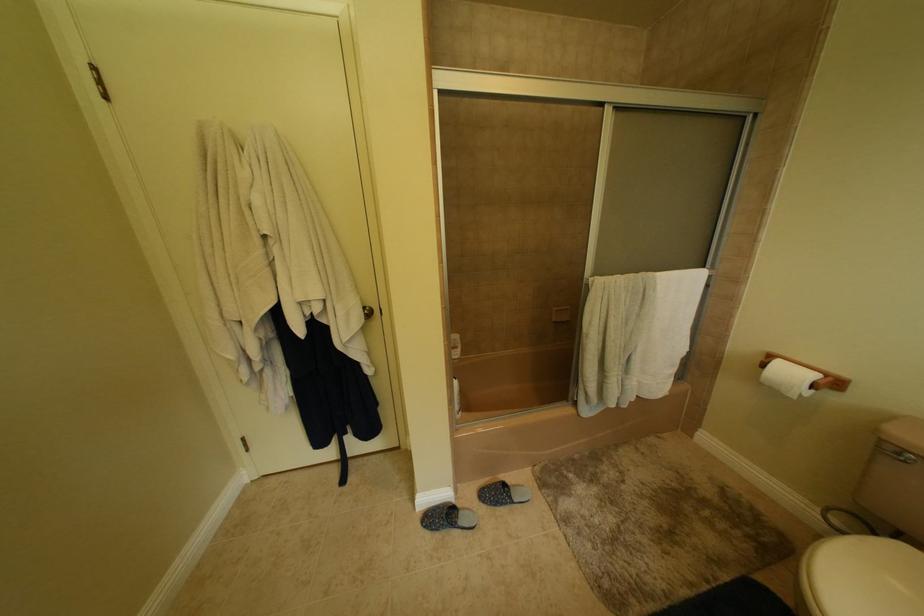
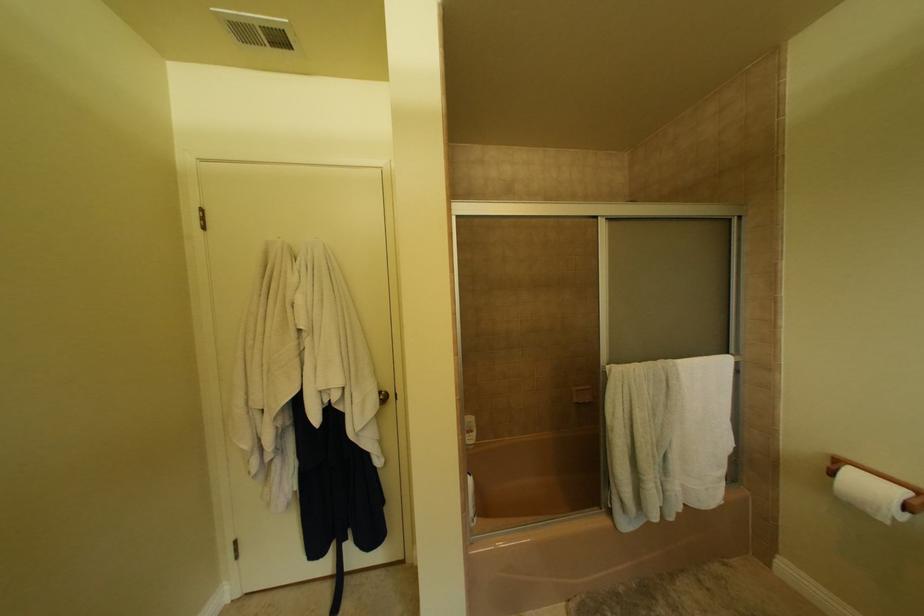
Question: How did the camera likely rotate?

Choices:
 (A) Left
 (B) Right
 (C) Up
 (D) Down

Answer: (C)